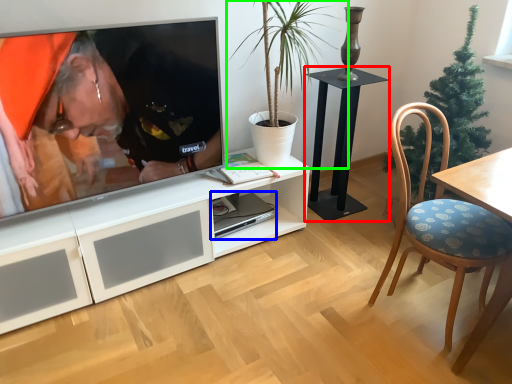
Question: Which is nearer to the table (highlighted by a red box)? computer (highlighted by a blue box) or houseplant (highlighted by a green box).

Choices:
 (A) computer
 (B) houseplant

Answer: (B)